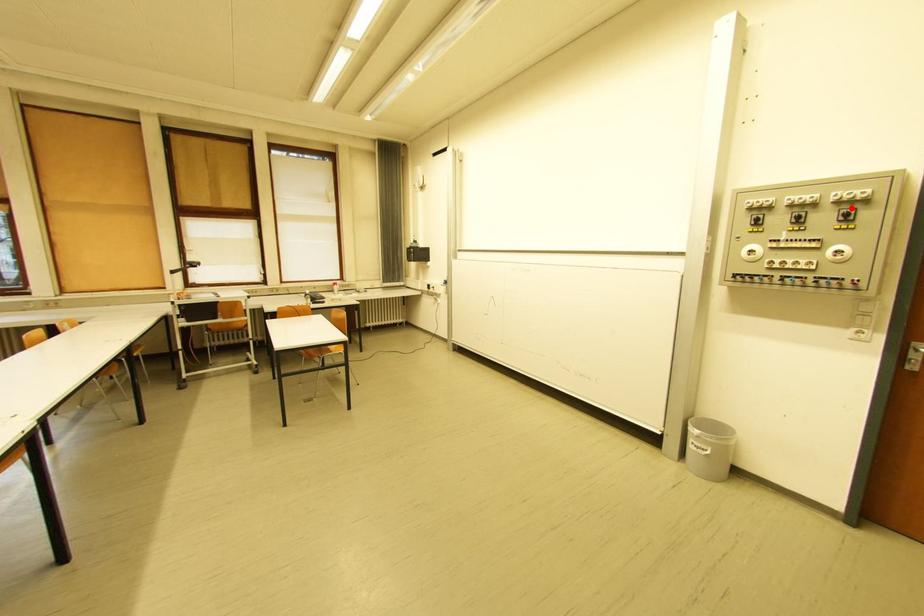
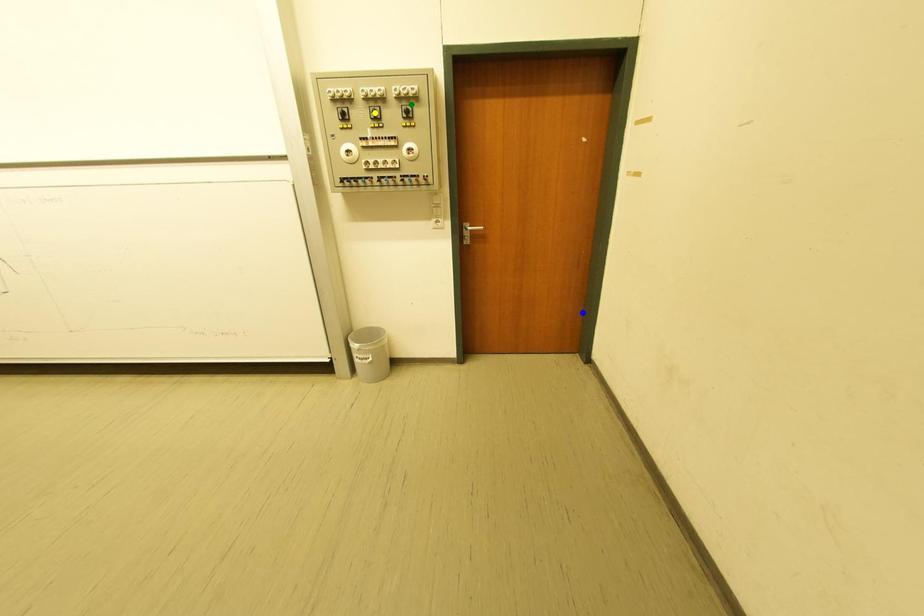
Question: I am providing you with two images of the same scene from different viewpoints. A red point is marked on the first image. You are given multiple points on the second image. Which point in image 2 is actually the same real-world point as the red point in image 1?

Choices:
 (A) yellow point
 (B) green point
 (C) blue point

Answer: (B)